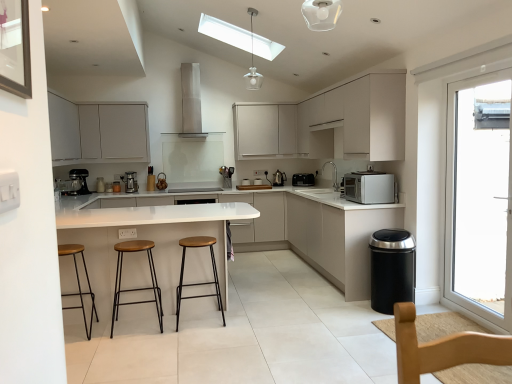
At what (x,y) coordinates should I click in order to perform the action: click on free space in front of white glossy table at center. Please return your answer as a coordinate pair (x, y). Looking at the image, I should click on (176, 356).